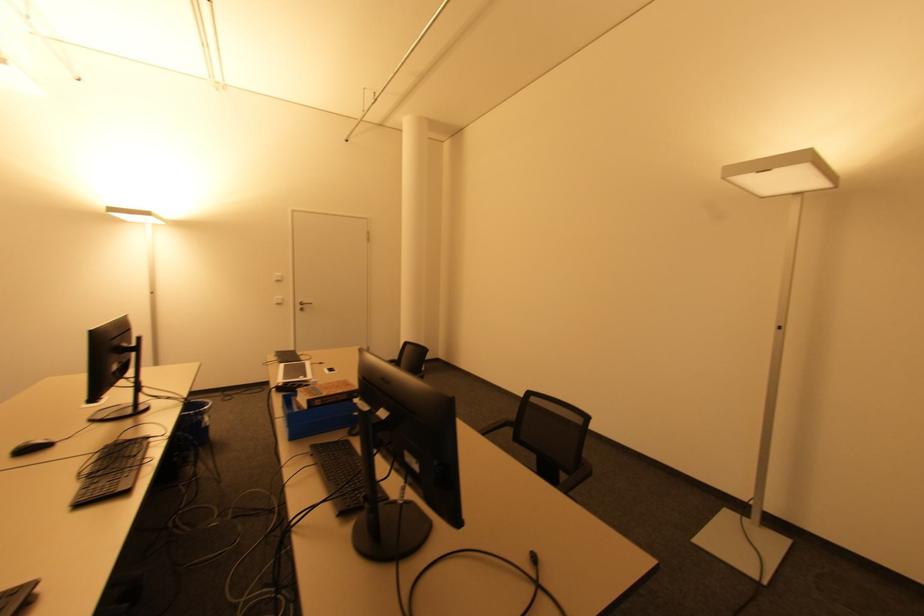
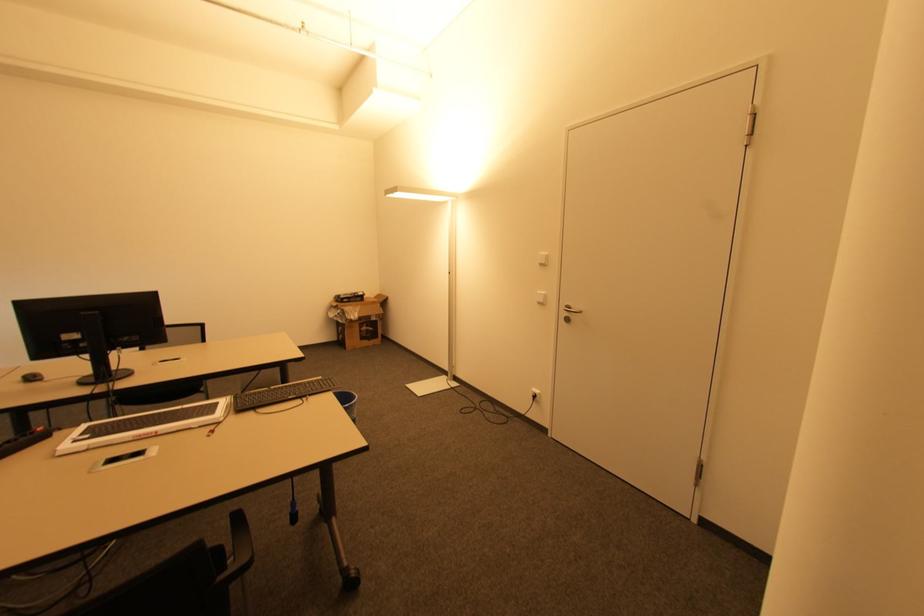
In the second image, find the point that corresponds to (280,304) in the first image.

(541, 302)